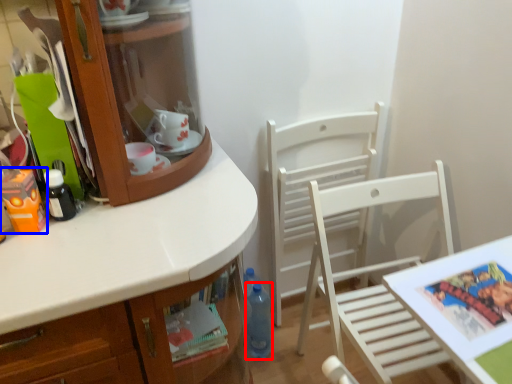
Question: Which object appears farthest to the camera in this image, bottle (highlighted by a red box) or toy (highlighted by a blue box)?

Choices:
 (A) bottle
 (B) toy

Answer: (A)